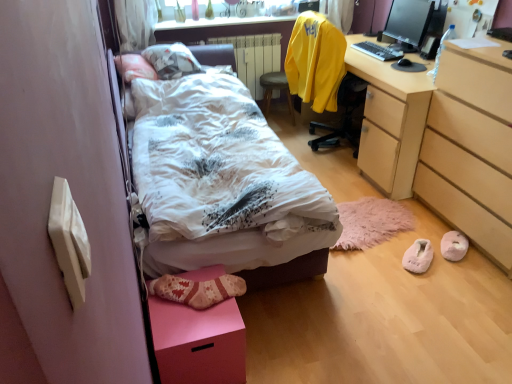
Question: Is white soft bed at center at the left side of peachy suede slippers at lower right, which is the first footwear in right-to-left order?

Choices:
 (A) yes
 (B) no

Answer: (A)

Question: Is white soft bed at center shorter than peachy suede slippers at lower right, which is the first footwear in right-to-left order?

Choices:
 (A) no
 (B) yes

Answer: (A)

Question: Is the position of white soft bed at center more distant than that of peachy suede slippers at lower right, which is the first footwear in right-to-left order?

Choices:
 (A) no
 (B) yes

Answer: (A)

Question: Is white soft bed at center not close to peachy suede slippers at lower right, which is the 2th footwear in left-to-right order?

Choices:
 (A) no
 (B) yes

Answer: (B)

Question: Does white soft bed at center have a smaller size compared to peachy suede slippers at lower right, which is the first footwear in right-to-left order?

Choices:
 (A) yes
 (B) no

Answer: (B)

Question: From the image's perspective, is white painted metal radiator at center above or below wooden stool at center?

Choices:
 (A) below
 (B) above

Answer: (B)

Question: Does point (266, 56) appear closer or farther from the camera than point (268, 92)?

Choices:
 (A) closer
 (B) farther

Answer: (A)

Question: From a real-world perspective, is white painted metal radiator at center above or below wooden stool at center?

Choices:
 (A) above
 (B) below

Answer: (A)

Question: Is white painted metal radiator at center bigger or smaller than wooden stool at center?

Choices:
 (A) small
 (B) big

Answer: (B)

Question: Looking at the image, does white painted metal radiator at center seem bigger or smaller compared to yellow fabric chair at upper right?

Choices:
 (A) small
 (B) big

Answer: (A)

Question: From their relative heights in the image, would you say white painted metal radiator at center is taller or shorter than yellow fabric chair at upper right?

Choices:
 (A) short
 (B) tall

Answer: (A)

Question: Is white painted metal radiator at center to the left or to the right of yellow fabric chair at upper right in the image?

Choices:
 (A) right
 (B) left

Answer: (B)

Question: Is point (256, 72) closer or farther from the camera than point (313, 56)?

Choices:
 (A) farther
 (B) closer

Answer: (A)

Question: Visually, is matte black monitor at upper right positioned to the left or to the right of white fluffy slippers at lower right, the 1th footwear viewed from the left?

Choices:
 (A) right
 (B) left

Answer: (A)

Question: Considering the positions of point (389, 14) and point (428, 248), is point (389, 14) closer or farther from the camera than point (428, 248)?

Choices:
 (A) farther
 (B) closer

Answer: (A)